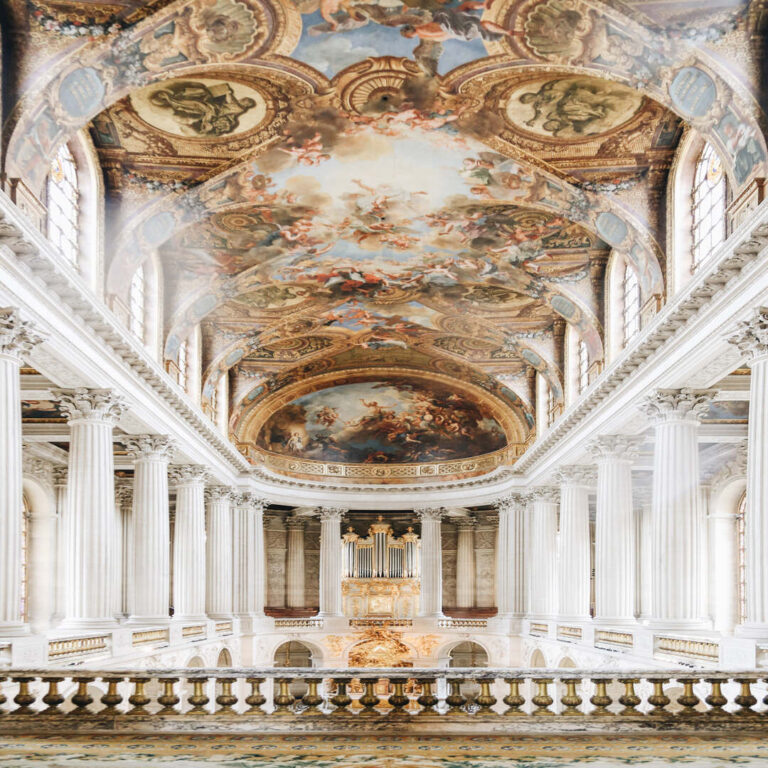
This screenshot has width=768, height=768. What are the coordinates of `arching doorways` in the screenshot? It's located at (298, 651), (475, 657).